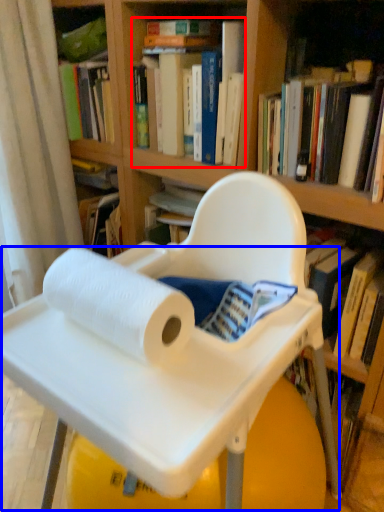
Question: Among these objects, which one is nearest to the camera, book (highlighted by a red box) or table (highlighted by a blue box)?

Choices:
 (A) book
 (B) table

Answer: (B)